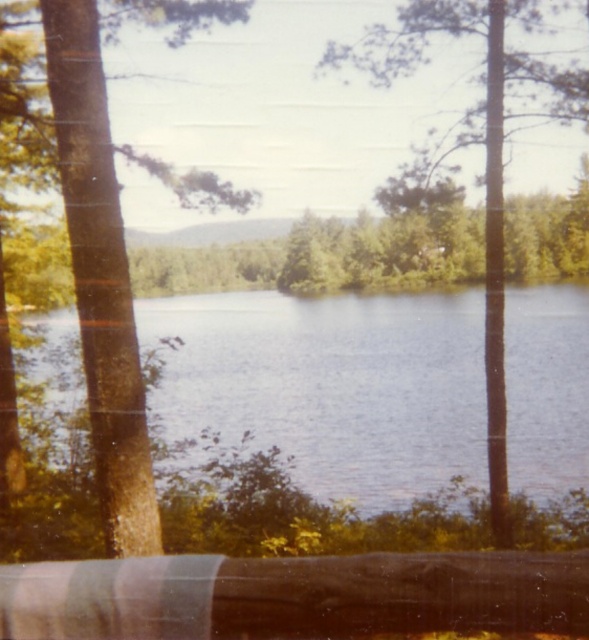
You are an observer standing at the lakeside. You see the blue water at center and the brown textured tree at left. Which object is closer to the bottom edge of the image?

The blue water at center is positioned under brown textured tree at left, so it is closer to the bottom edge of the image.